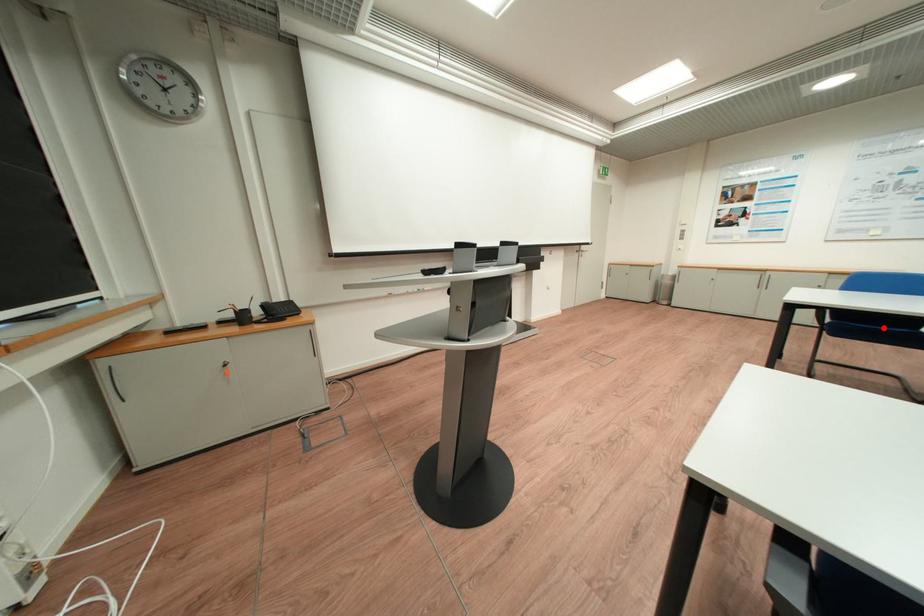
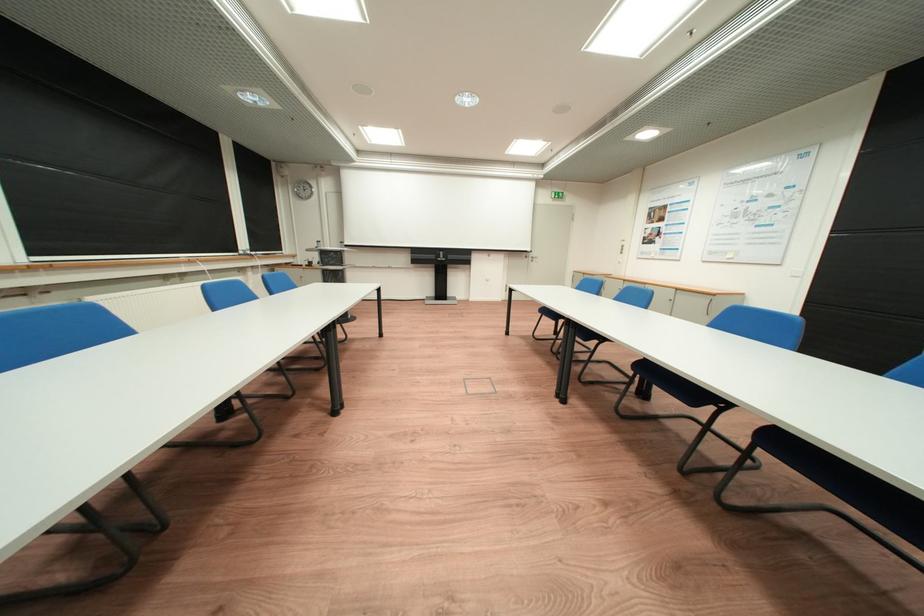
Question: I am providing you with two images of the same scene from different viewpoints. A red point is marked on the first image. Can you still see the location of the red point in image 2?

Choices:
 (A) Yes
 (B) No

Answer: (B)